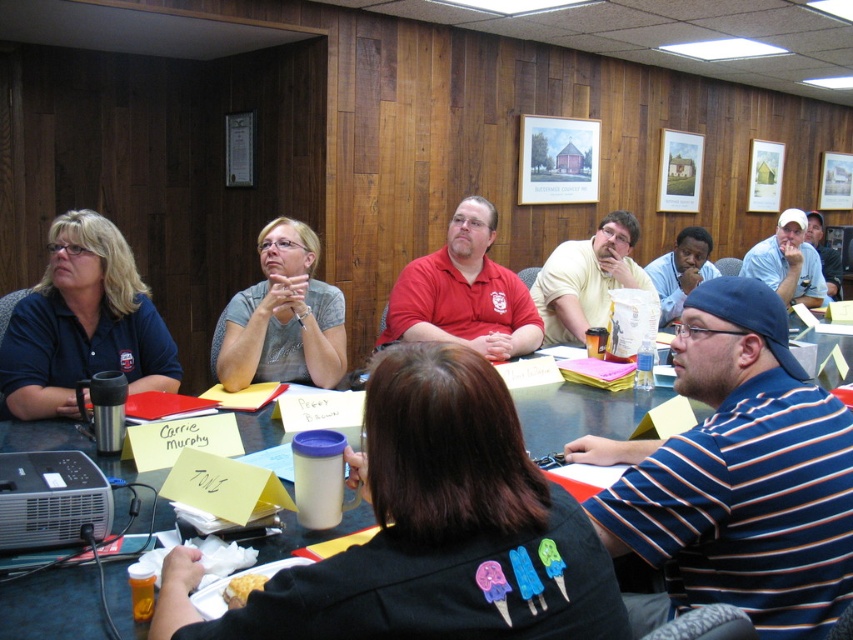
You are standing in the conference room and want to find the person wearing the matte blue shirt at left. Where should you look based on the coordinates provided?

The matte blue shirt at left is located at coordinates point [83,323].

You are organizing a photo shoot and need to arrange two shirts, the matte gray shirt at center and the yellow cotton shirt at center, based on their height. Which shirt should be placed first if you want to arrange them from shortest to tallest?

The matte gray shirt at center should be placed first because it is shorter than the yellow cotton shirt at center.